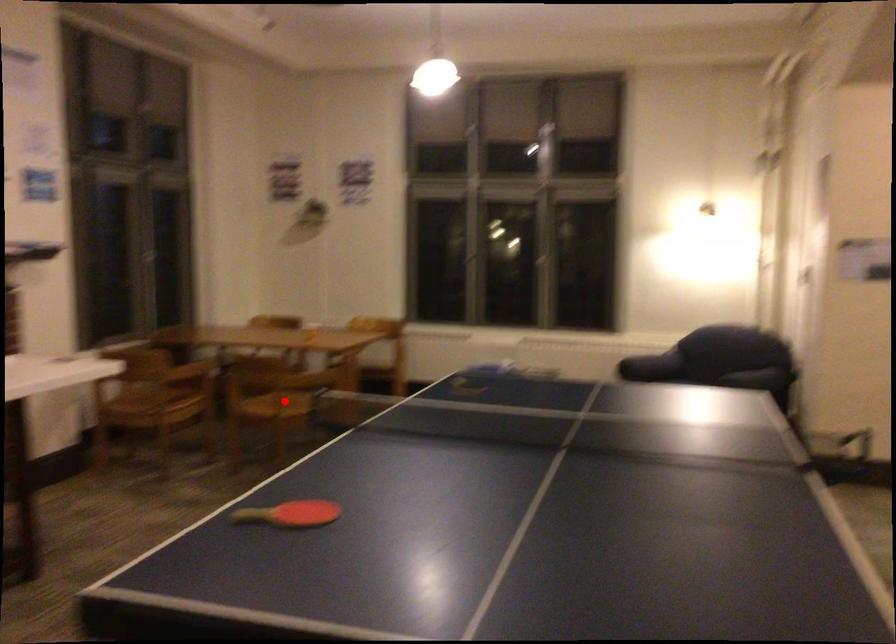
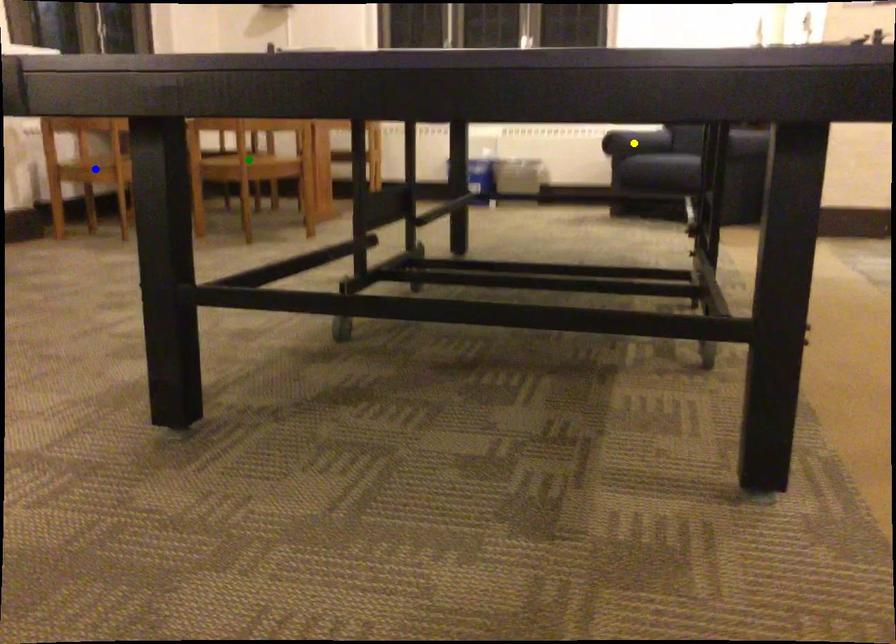
Question: I am providing you with two images of the same scene from different viewpoints. A red point is marked on the first image. You are given multiple points on the second image. Can you choose the point in image 2 that corresponds to the point in image 1?

Choices:
 (A) green point
 (B) blue point
 (C) yellow point

Answer: (A)